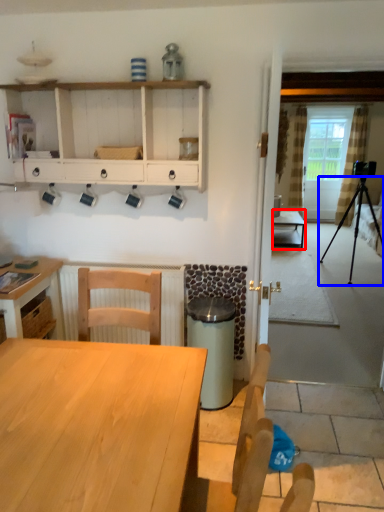
Question: Which point is closer to the camera, table (highlighted by a red box) or tripod (highlighted by a blue box)?

Choices:
 (A) table
 (B) tripod

Answer: (B)